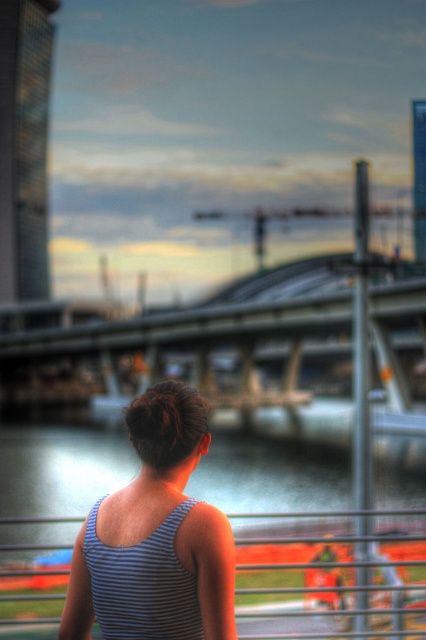
Question: Which of the following is the closest to the observer?

Choices:
 (A) metallic silver rail at center
 (B) striped fabric tank top at center
 (C) smooth water at lower center
 (D) concrete bridge at center

Answer: (B)

Question: Estimate the real-world distances between objects in this image. Which object is farther from the smooth water at lower center?

Choices:
 (A) concrete bridge at center
 (B) metallic silver rail at center

Answer: (B)

Question: Estimate the real-world distances between objects in this image. Which object is closer to the smooth water at lower center?

Choices:
 (A) metallic silver rail at center
 (B) concrete bridge at center

Answer: (B)

Question: Can you confirm if striped fabric tank top at center is smaller than metallic silver rail at center?

Choices:
 (A) yes
 (B) no

Answer: (A)

Question: Does concrete bridge at center have a smaller size compared to smooth water at lower center?

Choices:
 (A) no
 (B) yes

Answer: (A)

Question: Can you confirm if smooth water at lower center is positioned above metallic silver rail at center?

Choices:
 (A) yes
 (B) no

Answer: (B)